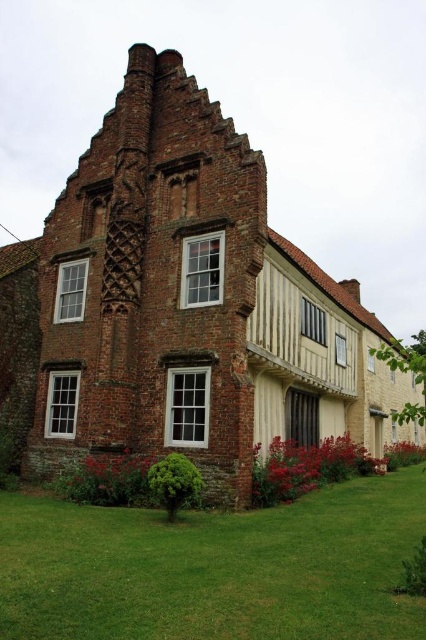
Question: Which object is the closest to the green grass at lower center?

Choices:
 (A) vivid red petals at lower left
 (B) vivid red petals at lower center

Answer: (A)

Question: Is vivid red petals at lower center wider than vivid red petals at lower left?

Choices:
 (A) no
 (B) yes

Answer: (B)

Question: Is green grass at lower center further to camera compared to vivid red petals at lower left?

Choices:
 (A) no
 (B) yes

Answer: (A)

Question: Is green grass at lower center in front of vivid red petals at lower left?

Choices:
 (A) yes
 (B) no

Answer: (A)

Question: Which of these objects is positioned closest to the vivid red petals at lower left?

Choices:
 (A) vivid red petals at lower center
 (B) green grass at lower center

Answer: (B)

Question: Based on their relative distances, which object is nearer to the green grass at lower center?

Choices:
 (A) vivid red petals at lower center
 (B) vivid red petals at lower left

Answer: (B)